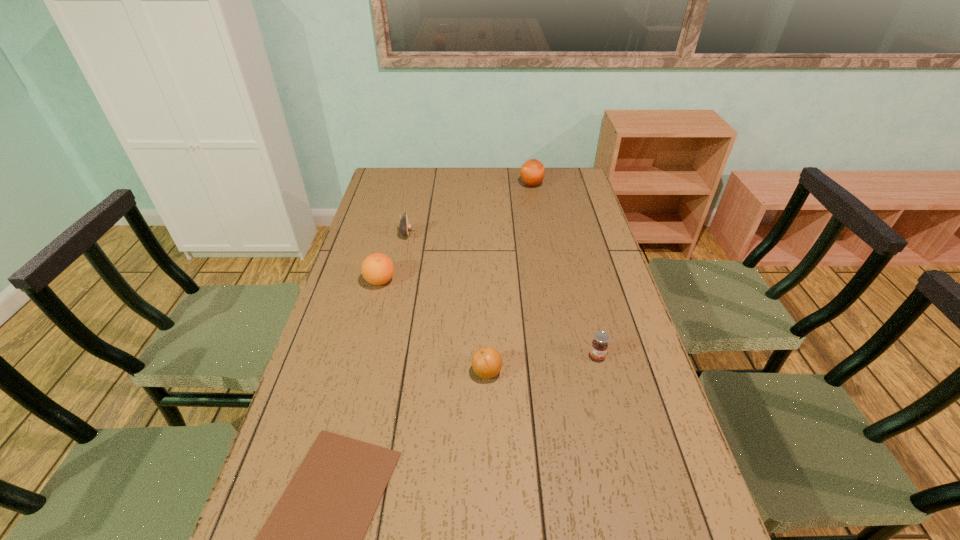
Find the location of `the farthest orange`. the farthest orange is located at coordinates (532, 172).

Where is `the farthest object`? This screenshot has height=540, width=960. the farthest object is located at coordinates (532, 172).

Where is `avocado`? This screenshot has width=960, height=540. avocado is located at coordinates (405, 227).

Where is `the second nearest orange`? This screenshot has width=960, height=540. the second nearest orange is located at coordinates (377, 269).

This screenshot has width=960, height=540. What are the coordinates of `the leftmost orange` in the screenshot? It's located at (377, 269).

I want to click on the rightmost object, so click(x=599, y=346).

I want to click on the shortest orange, so click(x=487, y=362).

Identify the location of the fourth object from left to right. [487, 362].

You are a GUI agent. You are given a task and a screenshot of the screen. Output one action in this format:
    pyautogui.click(x=<x>, y=<y>)
    Task: Click on the vacant space located on the front of the farthest object
    Image resolution: width=960 pixels, height=540 pixels.
    Given the screenshot: What is the action you would take?
    pyautogui.click(x=540, y=232)

Image resolution: width=960 pixels, height=540 pixels. Identify the location of vacant area situated 0.200m on the seed side of the avocado. (468, 234).